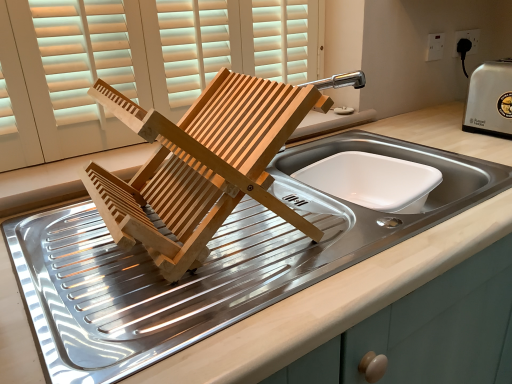
What do you see at coordinates (333, 303) in the screenshot? I see `satin silver sink at center` at bounding box center [333, 303].

At what (x,y) coordinates should I click in order to perform the action: click on satin silver sink at center. Please return your answer as a coordinate pair (x, y). The height and width of the screenshot is (384, 512). Looking at the image, I should click on (333, 303).

This screenshot has width=512, height=384. In order to click on satin silver sink at center in this screenshot , I will do `click(333, 303)`.